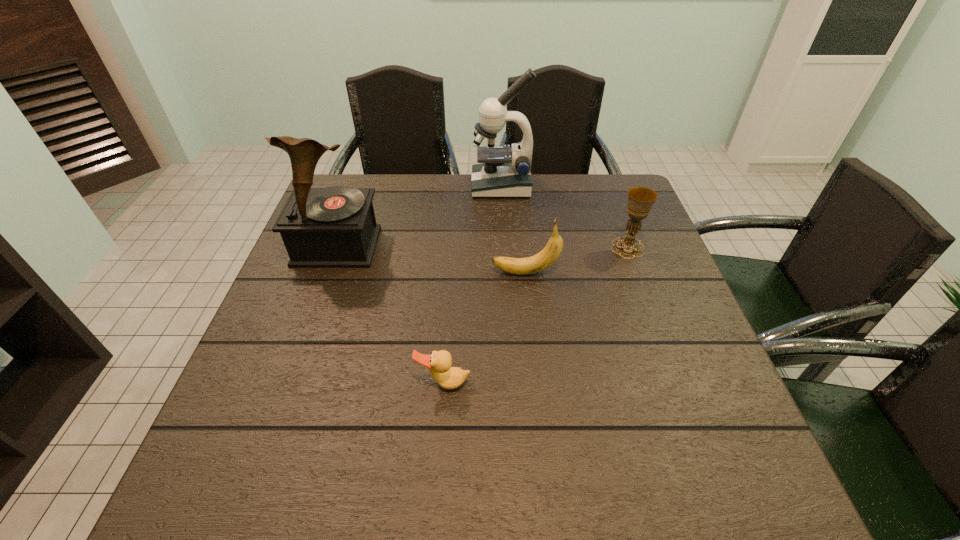
Find the location of a particular element. the farthest object is located at coordinates (505, 172).

At what (x,y) coordinates should I click in order to perform the action: click on the leftmost object. Please return your answer as a coordinate pair (x, y). Looking at the image, I should click on (334, 227).

Find the location of a particular element. the rightmost object is located at coordinates (640, 199).

You are a GUI agent. You are given a task and a screenshot of the screen. Output one action in this format:
    pyautogui.click(x=<x>, y=<y>)
    Task: Click on the banana
    The image size is (960, 540).
    Given the screenshot: What is the action you would take?
    pyautogui.click(x=521, y=266)

Identify the location of the shortest object. [439, 363].

Find the location of a particular element. Image resolution: width=960 pixels, height=540 pixels. the nearest object is located at coordinates (439, 363).

The height and width of the screenshot is (540, 960). In order to click on vacant space located at the eyepiece of the farthest object in this screenshot , I will do `click(406, 186)`.

The image size is (960, 540). I want to click on vacant space located 0.190m at the eyepiece of the farthest object, so click(x=412, y=186).

This screenshot has height=540, width=960. Identify the location of free space located at the eyepiece of the farthest object. (390, 186).

Where is `vacant region located 0.150m at the horn opening of the phonograph_record`? The width and height of the screenshot is (960, 540). vacant region located 0.150m at the horn opening of the phonograph_record is located at coordinates (313, 313).